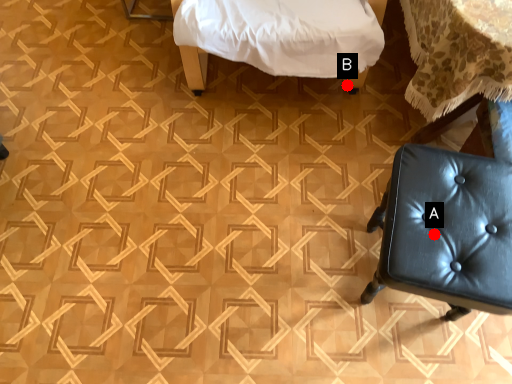
Question: Two points are circled on the image, labeled by A and B beside each circle. Which point is closer to the camera?

Choices:
 (A) A is closer
 (B) B is closer

Answer: (A)